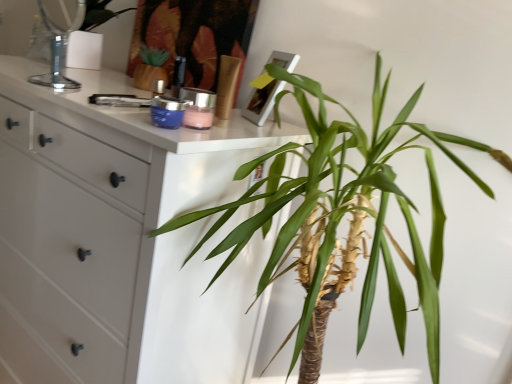
What do you see at coordinates (343, 212) in the screenshot?
I see `green leafy plant at center` at bounding box center [343, 212].

The image size is (512, 384). What do you see at coordinates (226, 86) in the screenshot?
I see `shiny gold lotion at center` at bounding box center [226, 86].

The image size is (512, 384). Find the location of `clear glass mirror at upper left`. clear glass mirror at upper left is located at coordinates (58, 48).

Considering the positions of points (57, 70) and (348, 205), is point (57, 70) closer to camera compared to point (348, 205)?

No, it is behind (348, 205).

Does clear glass mirror at upper left come in front of green leafy plant at center?

No, it is behind green leafy plant at center.

The height and width of the screenshot is (384, 512). I want to click on houseplant located on the right of clear glass mirror at upper left, so click(343, 212).

In terms of height, does clear glass mirror at upper left look taller or shorter compared to green leafy plant at center?

In the image, clear glass mirror at upper left appears to be shorter than green leafy plant at center.

Is shiny gold lotion at center to the left of white matte chest of drawers at left from the viewer's perspective?

No.

Is shiny gold lotion at center next to white matte chest of drawers at left and touching it?

No.

Between point (228, 79) and point (255, 210), which one is positioned behind?

The point (255, 210) is farther.

Is shiny gold lotion at center wider than white matte chest of drawers at left?

No.

From the image's perspective, is shiny gold lotion at center beneath green leafy plant at center?

Incorrect, from the image's perspective, shiny gold lotion at center is higher than green leafy plant at center.

Can you confirm if shiny gold lotion at center is wider than green leafy plant at center?

No, shiny gold lotion at center is not wider than green leafy plant at center.

In order to click on toiletry on the left of green leafy plant at center in this screenshot , I will do `click(226, 86)`.

Is shiny gold lotion at center turned away from green leafy plant at center?

That's not correct — shiny gold lotion at center is not looking away from green leafy plant at center.

Between point (86, 108) and point (339, 128), which one is positioned in front?

The point (86, 108) is in front.

Considering the relative sizes of white matte chest of drawers at left and green leafy plant at center in the image provided, is white matte chest of drawers at left smaller than green leafy plant at center?

Actually, white matte chest of drawers at left might be larger than green leafy plant at center.

Is green leafy plant at center inside white matte chest of drawers at left?

No.

Measure the distance between white matte chest of drawers at left and green leafy plant at center.

white matte chest of drawers at left and green leafy plant at center are 10.20 inches apart.

Is green leafy plant at center oriented towards clear glass mirror at upper left?

No.

Consider the image. Considering the relative positions of green leafy plant at center and clear glass mirror at upper left in the image provided, is green leafy plant at center to the left of clear glass mirror at upper left from the viewer's perspective?

Incorrect, green leafy plant at center is not on the left side of clear glass mirror at upper left.

Is green leafy plant at center thinner than clear glass mirror at upper left?

No, green leafy plant at center is not thinner than clear glass mirror at upper left.

In the scene shown: From the image's perspective, which object appears higher, green leafy plant at center or white matte chest of drawers at left?

green leafy plant at center.

Looking at their sizes, would you say green leafy plant at center is wider or thinner than white matte chest of drawers at left?

green leafy plant at center is thinner than white matte chest of drawers at left.

Is green leafy plant at center taller than white matte chest of drawers at left?

Incorrect, the height of green leafy plant at center is not larger of that of white matte chest of drawers at left.

Does green leafy plant at center come in front of white matte chest of drawers at left?

Yes.

Which is nearer, (126,144) or (228,78)?

The point (126,144) is closer to the camera.

Would you say white matte chest of drawers at left is a long distance from shiny gold lotion at center?

No, there isn't a large distance between white matte chest of drawers at left and shiny gold lotion at center.

Who is taller, white matte chest of drawers at left or shiny gold lotion at center?

white matte chest of drawers at left.

Is white matte chest of drawers at left at the right side of shiny gold lotion at center?

Incorrect, white matte chest of drawers at left is not on the right side of shiny gold lotion at center.

Locate an element on the screen. This screenshot has width=512, height=384. mirror above the green leafy plant at center (from the image's perspective) is located at coordinates (58, 48).

The height and width of the screenshot is (384, 512). I want to click on toiletry on the right of white matte chest of drawers at left, so click(x=226, y=86).

From the image, which object appears to be nearer to shiny gold lotion at center, green leafy plant at center or clear glass mirror at upper left?

The object closer to shiny gold lotion at center is green leafy plant at center.

Based on their spatial positions, is white matte chest of drawers at left or shiny gold lotion at center further from clear glass mirror at upper left?

shiny gold lotion at center lies further to clear glass mirror at upper left than the other object.

Looking at the image, which one is located closer to shiny gold lotion at center, clear glass mirror at upper left or green leafy plant at center?

Among the two, green leafy plant at center is located nearer to shiny gold lotion at center.

Based on their spatial positions, is white matte chest of drawers at left or clear glass mirror at upper left closer to green leafy plant at center?

The object closer to green leafy plant at center is white matte chest of drawers at left.

Estimate the real-world distances between objects in this image. Which object is closer to white matte chest of drawers at left, shiny gold lotion at center or green leafy plant at center?

The object closer to white matte chest of drawers at left is green leafy plant at center.

Estimate the real-world distances between objects in this image. Which object is further from shiny gold lotion at center, green leafy plant at center or white matte chest of drawers at left?

white matte chest of drawers at left.

From the image, which object appears to be farther from shiny gold lotion at center, white matte chest of drawers at left or clear glass mirror at upper left?

clear glass mirror at upper left is further to shiny gold lotion at center.

Looking at the image, which one is located closer to white matte chest of drawers at left, clear glass mirror at upper left or shiny gold lotion at center?

clear glass mirror at upper left lies closer to white matte chest of drawers at left than the other object.

This screenshot has width=512, height=384. What are the coordinates of `toiletry between clear glass mirror at upper left and white matte chest of drawers at left vertically` in the screenshot? It's located at (226, 86).

This screenshot has width=512, height=384. I want to click on toiletry between clear glass mirror at upper left and green leafy plant at center in the vertical direction, so click(226, 86).

Find the location of a particular element. The image size is (512, 384). toiletry between white matte chest of drawers at left and green leafy plant at center from left to right is located at coordinates (226, 86).

Where is `houseplant between clear glass mirror at upper left and white matte chest of drawers at left in the up-down direction`? The height and width of the screenshot is (384, 512). houseplant between clear glass mirror at upper left and white matte chest of drawers at left in the up-down direction is located at coordinates (343, 212).